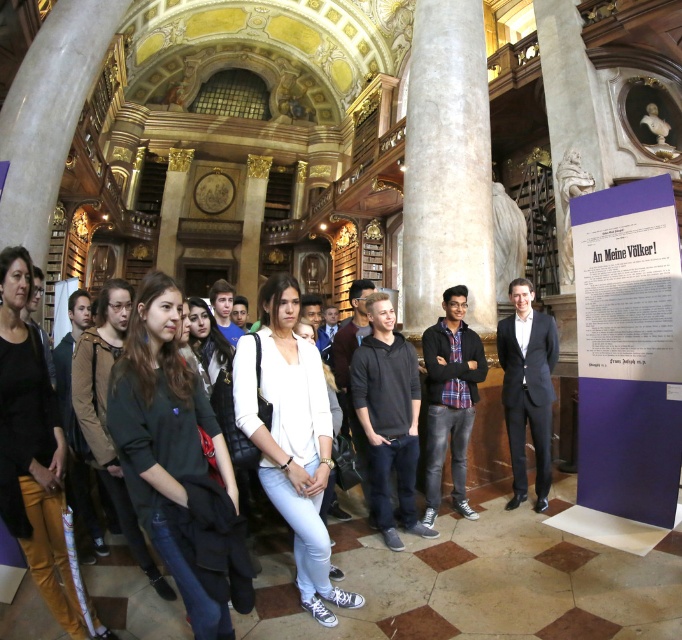
You are a tour guide leading a group in this grand library. You need to place a new information panel between the purple paper at center and the white marble pillar at center. The panel requires a minimum of 20 feet of space to be placed safely. Can you fit the panel between them?

The purple paper at center is 26.95 feet away from the white marble pillar at center, so yes, the panel can be placed between them as there is sufficient space exceeding the required 20 feet.